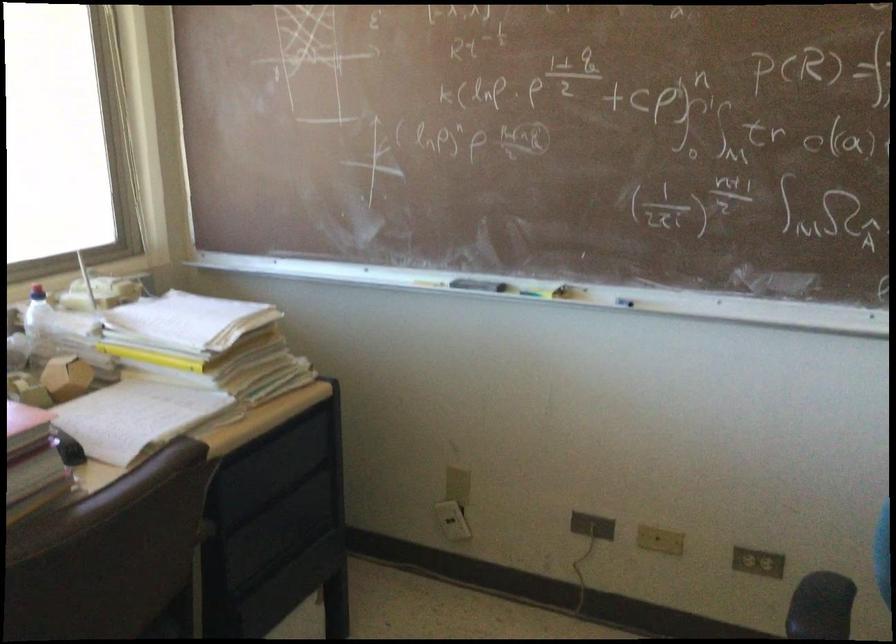
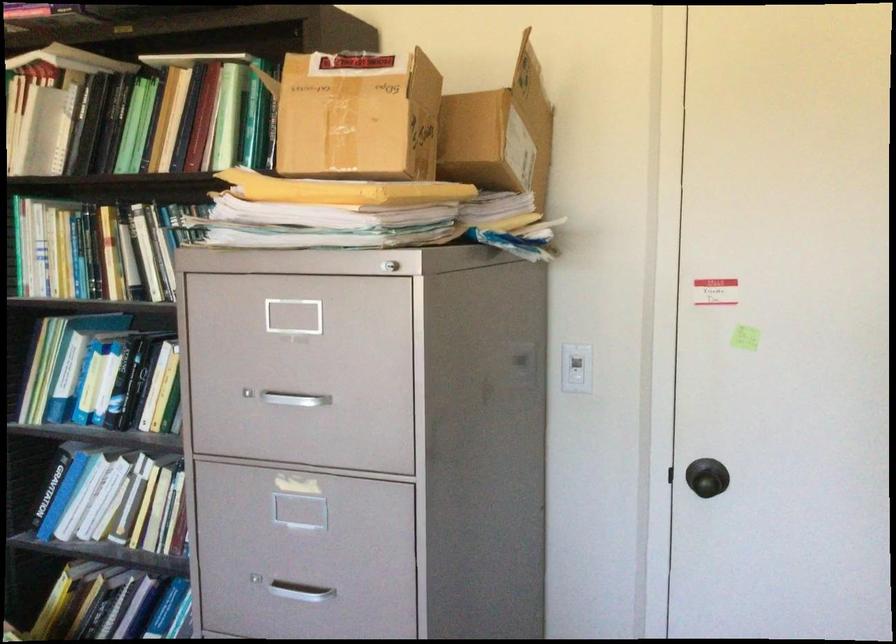
Question: The first image is from the beginning of the video and the second image is from the end. How did the camera likely rotate when shooting the video?

Choices:
 (A) Left
 (B) Right
 (C) Up
 (D) Down

Answer: (B)